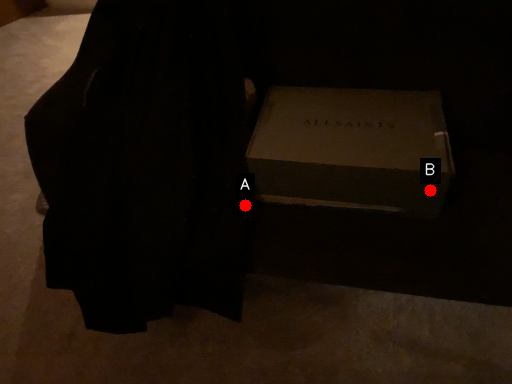
Question: Two points are circled on the image, labeled by A and B beside each circle. Which point appears farthest from the camera in this image?

Choices:
 (A) A is further
 (B) B is further

Answer: (A)